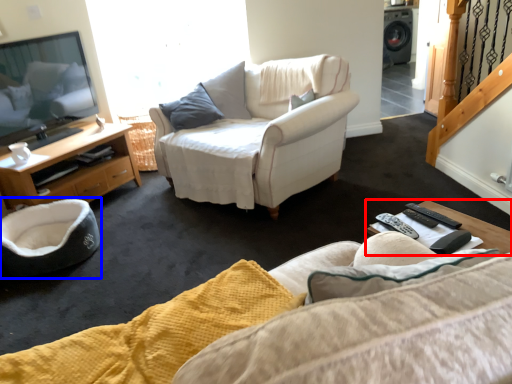
Question: Among these objects, which one is farthest to the camera, coffee table (highlighted by a red box) or swivel chair (highlighted by a blue box)?

Choices:
 (A) coffee table
 (B) swivel chair

Answer: (B)